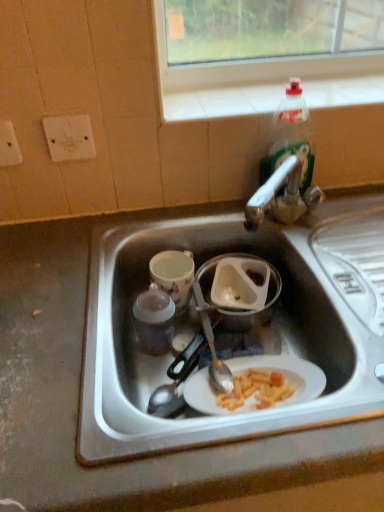
Question: Would you say white plastic container at center contains white matte sink at center?

Choices:
 (A) no
 (B) yes

Answer: (A)

Question: Is white plastic container at center directly adjacent to white matte sink at center?

Choices:
 (A) no
 (B) yes

Answer: (A)

Question: Is white plastic container at center positioned with its back to white matte sink at center?

Choices:
 (A) no
 (B) yes

Answer: (B)

Question: Is white plastic container at center positioned behind white matte sink at center?

Choices:
 (A) no
 (B) yes

Answer: (B)

Question: Is white plastic container at center positioned far away from white matte sink at center?

Choices:
 (A) no
 (B) yes

Answer: (A)

Question: In terms of size, does porcelain cup at center-left appear bigger or smaller than clear plastic bottle at upper right?

Choices:
 (A) big
 (B) small

Answer: (B)

Question: In the image, is porcelain cup at center-left on the left side or the right side of clear plastic bottle at upper right?

Choices:
 (A) right
 (B) left

Answer: (B)

Question: Considering the positions of porcelain cup at center-left and clear plastic bottle at upper right in the image, is porcelain cup at center-left wider or thinner than clear plastic bottle at upper right?

Choices:
 (A) wide
 (B) thin

Answer: (A)

Question: Would you say porcelain cup at center-left is inside or outside clear plastic bottle at upper right?

Choices:
 (A) outside
 (B) inside

Answer: (A)

Question: In terms of size, does clear plastic bottle at upper right appear bigger or smaller than white plastic container at center?

Choices:
 (A) big
 (B) small

Answer: (A)

Question: Is clear plastic bottle at upper right in front of or behind white plastic container at center in the image?

Choices:
 (A) behind
 (B) front

Answer: (B)

Question: From a real-world perspective, is clear plastic bottle at upper right positioned above or below white plastic container at center?

Choices:
 (A) below
 (B) above

Answer: (B)

Question: Is clear plastic bottle at upper right situated inside white plastic container at center or outside?

Choices:
 (A) inside
 (B) outside

Answer: (B)

Question: From a real-world perspective, is clear plastic bottle at upper right physically located above or below porcelain cup at center-left?

Choices:
 (A) above
 (B) below

Answer: (A)

Question: Looking at their shapes, would you say clear plastic bottle at upper right is wider or thinner than porcelain cup at center-left?

Choices:
 (A) wide
 (B) thin

Answer: (B)